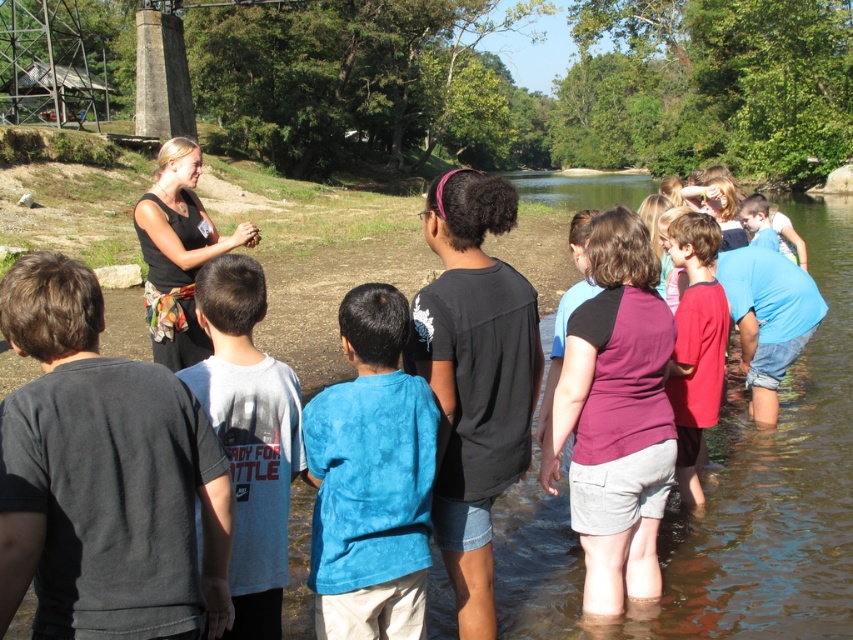
Can you confirm if dark gray cotton shirt at left is positioned to the right of purple cotton shirt at center?

Incorrect, dark gray cotton shirt at left is not on the right side of purple cotton shirt at center.

Image resolution: width=853 pixels, height=640 pixels. Identify the location of dark gray cotton shirt at left. (97, 472).

Is blue cotton shirt at center positioned behind purple cotton shirt at center?

No.

Does blue cotton shirt at center appear under purple cotton shirt at center?

Correct, blue cotton shirt at center is located below purple cotton shirt at center.

The width and height of the screenshot is (853, 640). Identify the location of blue cotton shirt at center. (370, 477).

Which is above, blue cotton shirt at center or red matte shirt at center?

red matte shirt at center is higher up.

Is point (360, 582) closer to camera compared to point (718, 336)?

Yes, point (360, 582) is closer to viewer.

Who is more forward, (364, 614) or (708, 216)?

Point (364, 614)

Locate an element on the screen. The image size is (853, 640). blue cotton shirt at center is located at coordinates [370, 477].